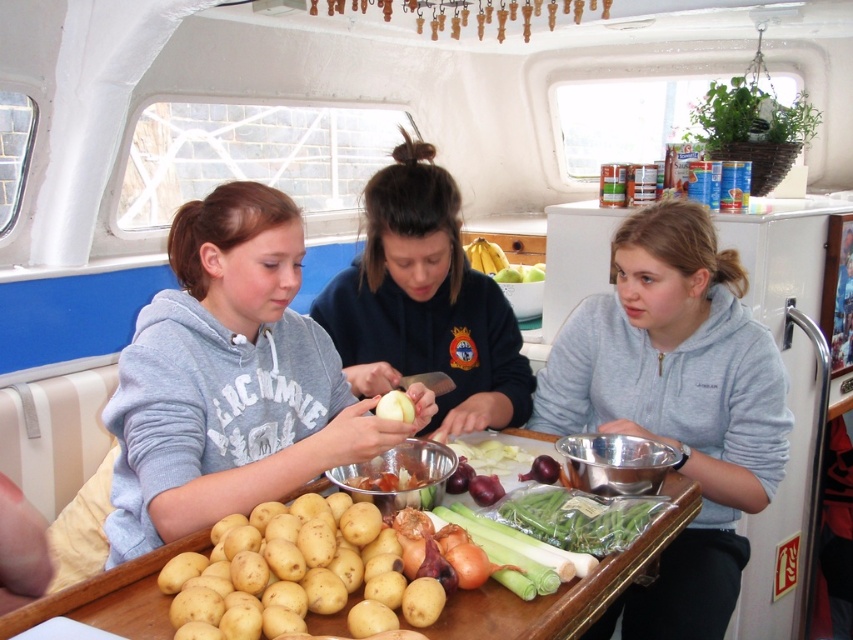
Which of these two, matte gray hoodie at center or green plastic bag of green beans at center, stands shorter?

green plastic bag of green beans at center is shorter.

Is matte gray hoodie at center below green plastic bag of green beans at center?

No, matte gray hoodie at center is not below green plastic bag of green beans at center.

At what (x,y) coordinates should I click in order to perform the action: click on matte gray hoodie at center. Please return your answer as a coordinate pair (x, y). This screenshot has height=640, width=853. Looking at the image, I should click on (230, 380).

Does dark blue sweatshirt at center have a larger size compared to green plastic bag of green beans at center?

Yes, dark blue sweatshirt at center is bigger than green plastic bag of green beans at center.

What do you see at coordinates (425, 304) in the screenshot? This screenshot has width=853, height=640. I see `dark blue sweatshirt at center` at bounding box center [425, 304].

Which is behind, point (389, 182) or point (570, 513)?

The point (389, 182) is behind.

You are a GUI agent. You are given a task and a screenshot of the screen. Output one action in this format:
    pyautogui.click(x=<x>, y=<y>)
    Task: Click on the dark blue sweatshirt at center
    
    Given the screenshot: What is the action you would take?
    pos(425,304)

Measure the distance between point (358,605) and camera.

The distance of point (358,605) from camera is 1.06 meters.

Can you confirm if yellow matte potatoes at center is wider than smooth wooden table at center?

No.

Image resolution: width=853 pixels, height=640 pixels. In order to click on yellow matte potatoes at center in this screenshot , I will do `click(294, 573)`.

Locate an element on the screen. The width and height of the screenshot is (853, 640). yellow matte potatoes at center is located at coordinates (294, 573).